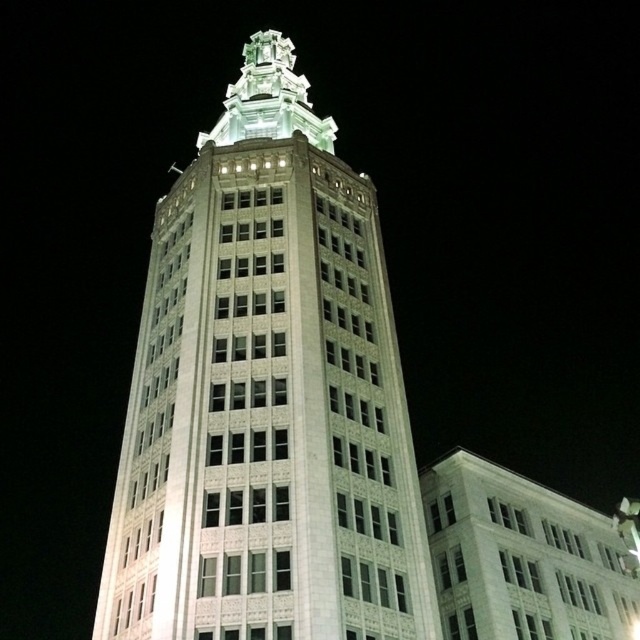
You are an architect planning to install a new light on the building. You have two options for placement based on the image. One is near the white stone tower at center and the other is near the white glossy spire at upper center. Which location would be lower in height?

The white stone tower at center is positioned under the white glossy spire at upper center, so the white stone tower at center is lower in height.

You are an architect reviewing the building design. You need to determine which object, the white stone tower at center or the white glossy spire at upper center, is bigger in size. Which one is larger?

The white stone tower at center is larger in size compared to the white glossy spire at upper center according to the description.